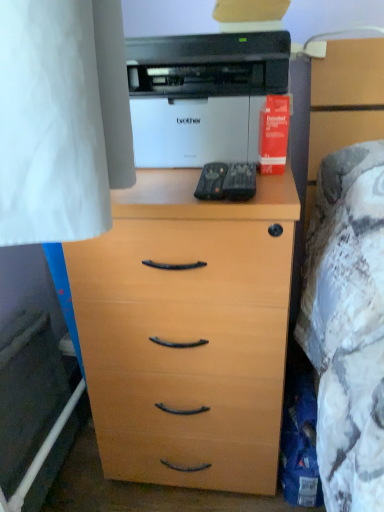
Question: Can you confirm if light wood chest of drawers at center is bigger than white glossy printer at upper center?

Choices:
 (A) no
 (B) yes

Answer: (B)

Question: Is light wood chest of drawers at center in contact with white glossy printer at upper center?

Choices:
 (A) no
 (B) yes

Answer: (A)

Question: Does light wood chest of drawers at center have a smaller size compared to white glossy printer at upper center?

Choices:
 (A) yes
 (B) no

Answer: (B)

Question: From the image's perspective, is light wood chest of drawers at center under white glossy printer at upper center?

Choices:
 (A) no
 (B) yes

Answer: (B)

Question: Can you confirm if light wood chest of drawers at center is thinner than white glossy printer at upper center?

Choices:
 (A) yes
 (B) no

Answer: (B)

Question: Relative to white glossy printer at upper center, is red matte paper at upper right in front or behind?

Choices:
 (A) front
 (B) behind

Answer: (B)

Question: In terms of height, does red matte paper at upper right look taller or shorter compared to white glossy printer at upper center?

Choices:
 (A) short
 (B) tall

Answer: (A)

Question: Would you say red matte paper at upper right is to the left or to the right of white glossy printer at upper center in the picture?

Choices:
 (A) left
 (B) right

Answer: (B)

Question: Is red matte paper at upper right bigger or smaller than white glossy printer at upper center?

Choices:
 (A) big
 (B) small

Answer: (B)

Question: From a real-world perspective, relative to red matte paper at upper right, is light wood chest of drawers at center vertically above or below?

Choices:
 (A) above
 (B) below

Answer: (B)

Question: Based on their positions, is light wood chest of drawers at center located to the left or right of red matte paper at upper right?

Choices:
 (A) left
 (B) right

Answer: (A)

Question: Considering the positions of point tap(284, 218) and point tap(284, 121), is point tap(284, 218) closer or farther from the camera than point tap(284, 121)?

Choices:
 (A) farther
 (B) closer

Answer: (B)

Question: Based on their sizes in the image, would you say light wood chest of drawers at center is bigger or smaller than red matte paper at upper right?

Choices:
 (A) small
 (B) big

Answer: (B)

Question: Based on their sizes in the image, would you say red matte paper at upper right is bigger or smaller than light wood chest of drawers at center?

Choices:
 (A) small
 (B) big

Answer: (A)

Question: In terms of width, does red matte paper at upper right look wider or thinner when compared to light wood chest of drawers at center?

Choices:
 (A) wide
 (B) thin

Answer: (B)